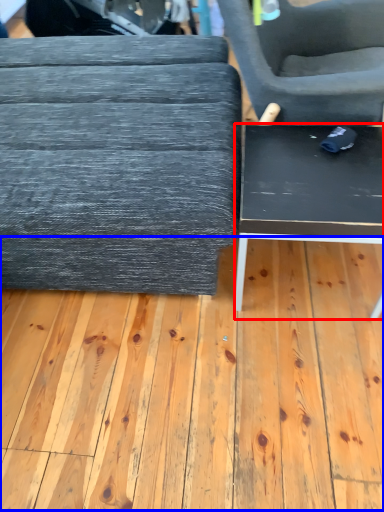
Question: Which object appears closest to the camera in this image, table (highlighted by a red box) or plywood (highlighted by a blue box)?

Choices:
 (A) table
 (B) plywood

Answer: (B)